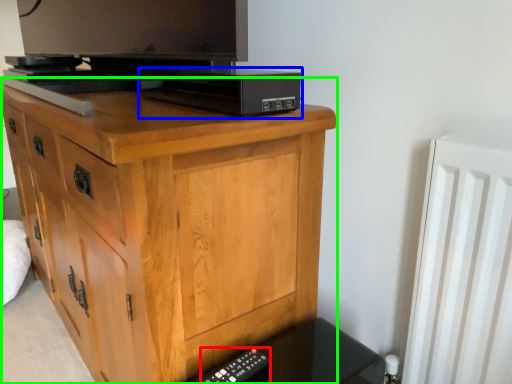
Question: Which object is the farthest from remote (highlighted by a red box)? Choose among these: computer (highlighted by a blue box) or chest of drawers (highlighted by a green box).

Choices:
 (A) computer
 (B) chest of drawers

Answer: (A)